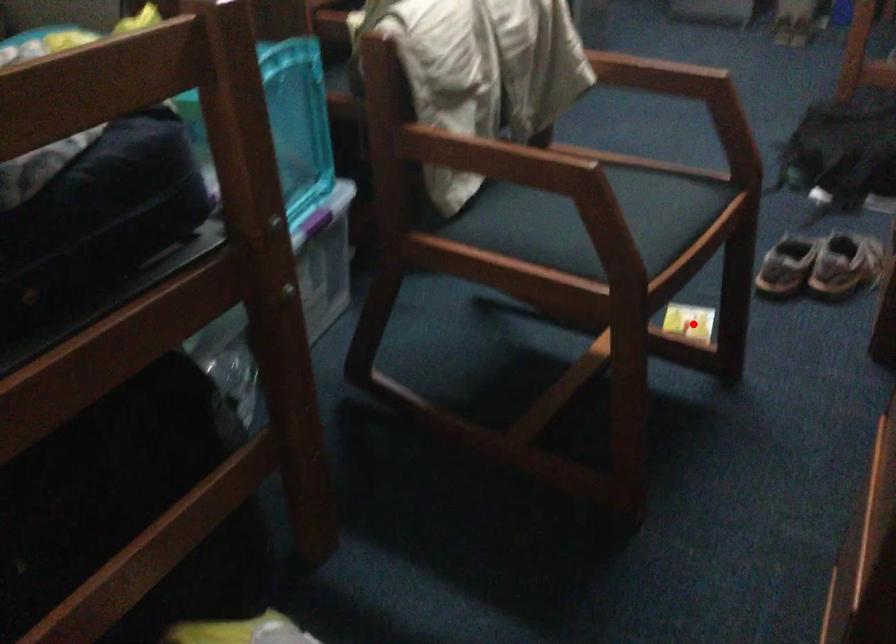
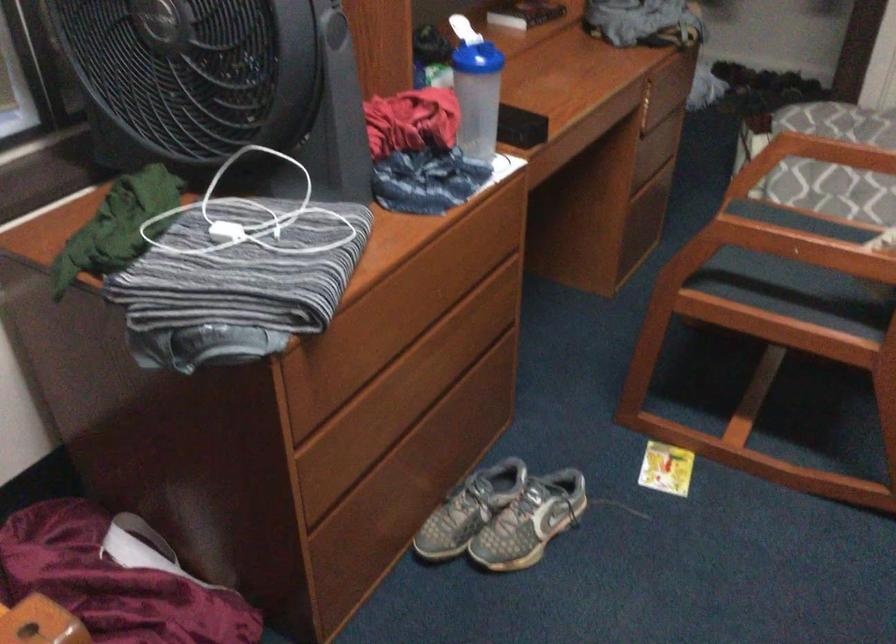
Find the pixel in the second image that matches the highlighted location in the first image.

(666, 468)